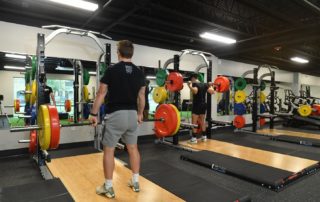
The height and width of the screenshot is (202, 320). I want to click on mirrors, so click(65, 86), click(151, 100).